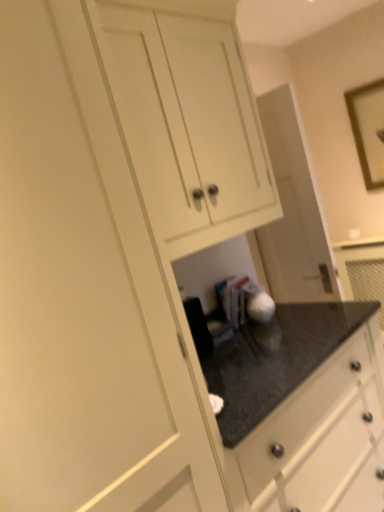
Question: Does white matte cabinet at upper center lie behind wooden framed picture at upper right?

Choices:
 (A) yes
 (B) no

Answer: (B)

Question: Does white matte cabinet at upper center have a lesser width compared to wooden framed picture at upper right?

Choices:
 (A) no
 (B) yes

Answer: (A)

Question: Is white matte cabinet at upper center aimed at wooden framed picture at upper right?

Choices:
 (A) yes
 (B) no

Answer: (B)

Question: From the image's perspective, is white matte cabinet at upper center below wooden framed picture at upper right?

Choices:
 (A) no
 (B) yes

Answer: (B)

Question: Are white matte cabinet at upper center and wooden framed picture at upper right located far from each other?

Choices:
 (A) no
 (B) yes

Answer: (B)

Question: Does white matte cabinet at upper center have a larger size compared to wooden framed picture at upper right?

Choices:
 (A) no
 (B) yes

Answer: (B)

Question: Does wooden framed picture at upper right turn towards white matte cabinet at upper center?

Choices:
 (A) yes
 (B) no

Answer: (A)

Question: Is wooden framed picture at upper right closer to camera compared to white matte cabinet at upper center?

Choices:
 (A) yes
 (B) no

Answer: (B)

Question: Can white matte cabinet at upper center be found inside wooden framed picture at upper right?

Choices:
 (A) yes
 (B) no

Answer: (B)

Question: Can you confirm if wooden framed picture at upper right is bigger than white matte cabinet at upper center?

Choices:
 (A) yes
 (B) no

Answer: (B)

Question: From a real-world perspective, is wooden framed picture at upper right positioned under white matte cabinet at upper center based on gravity?

Choices:
 (A) no
 (B) yes

Answer: (B)

Question: Is wooden framed picture at upper right thinner than white matte cabinet at upper center?

Choices:
 (A) yes
 (B) no

Answer: (A)

Question: Is wooden framed picture at upper right wider or thinner than white matte cabinet at upper center?

Choices:
 (A) wide
 (B) thin

Answer: (B)